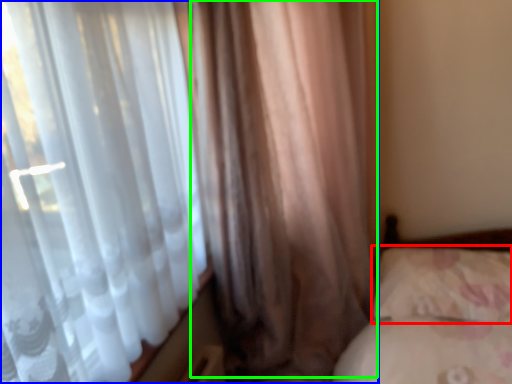
Question: Estimate the real-world distances between objects in this image. Which object is closer to pillow (highlighted by a red box), curtain (highlighted by a blue box) or curtain (highlighted by a green box)?

Choices:
 (A) curtain
 (B) curtain

Answer: (B)